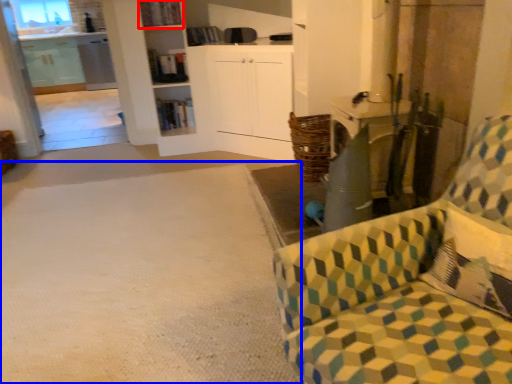
Question: Which object appears farthest to the camera in this image, shelf (highlighted by a red box) or plain (highlighted by a blue box)?

Choices:
 (A) shelf
 (B) plain

Answer: (A)